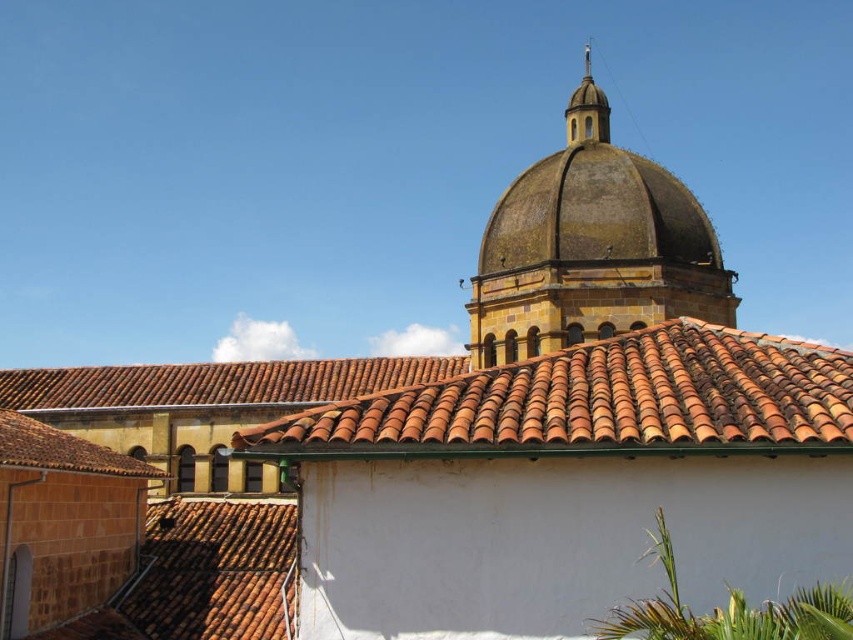
Question: Can you confirm if terracotta tiles at center is positioned above rusty stone dome at upper center?

Choices:
 (A) no
 (B) yes

Answer: (A)

Question: Which point appears farthest from the camera in this image?

Choices:
 (A) (514, 188)
 (B) (601, 138)
 (C) (770, 397)
 (D) (635, 241)

Answer: (B)

Question: Among these objects, which one is nearest to the camera?

Choices:
 (A) brown textured dome at center
 (B) smooth gold dome at upper center
 (C) rusty stone dome at upper center
 (D) terracotta tiles at center

Answer: (D)

Question: Can you confirm if rusty stone dome at upper center is positioned below smooth gold dome at upper center?

Choices:
 (A) no
 (B) yes

Answer: (B)

Question: Estimate the real-world distances between objects in this image. Which object is farther from the smooth gold dome at upper center?

Choices:
 (A) rusty stone dome at upper center
 (B) terracotta tiles at center

Answer: (B)

Question: Is brown textured dome at center wider than smooth gold dome at upper center?

Choices:
 (A) no
 (B) yes

Answer: (B)